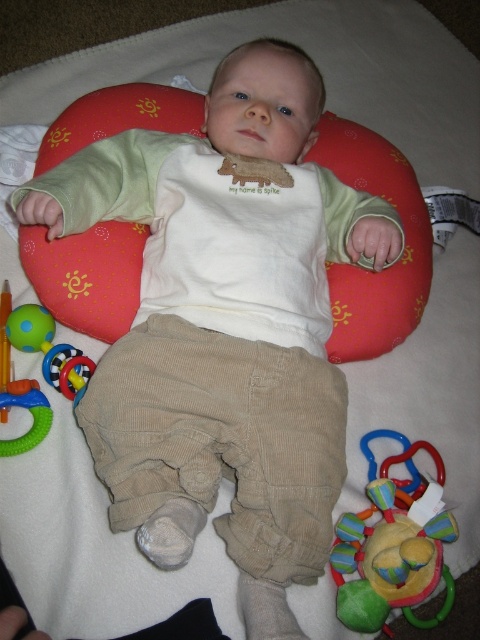
You are a photographer taking a picture of the baby. You notice two points in the scene labeled as point 1 at coordinates point (351,531) and point 2 at coordinates point (3,451). Which point should you focus on to ensure the baby is in sharp focus?

You should focus on point (351,531) because it is closer to the viewer than point (3,451), so focusing there will keep the baby in sharp focus.

From the picture: You are a parent trying to place a small toy between the red fabric bean bag chair at center and the multicolored fabric rattle at lower right. The toy requires at least 24 inches of space to fit. Can you fit the toy between them?

The red fabric bean bag chair at center and multicolored fabric rattle at lower right are 25.21 inches apart from each other, so yes, the toy can fit between them since the required space is 24 inches and the available space is 25.21 inches.

You are a parent trying to place a new toy between the red fabric bean bag chair at center and the rubberized plastic rattle at lower left. Based on the scene description, where should you position the new toy?

The red fabric bean bag chair at center is to the right of the rubberized plastic rattle at lower left, so you should place the new toy between them by positioning it to the right of the rubberized plastic rattle at lower left and to the left of the red fabric bean bag chair at center.